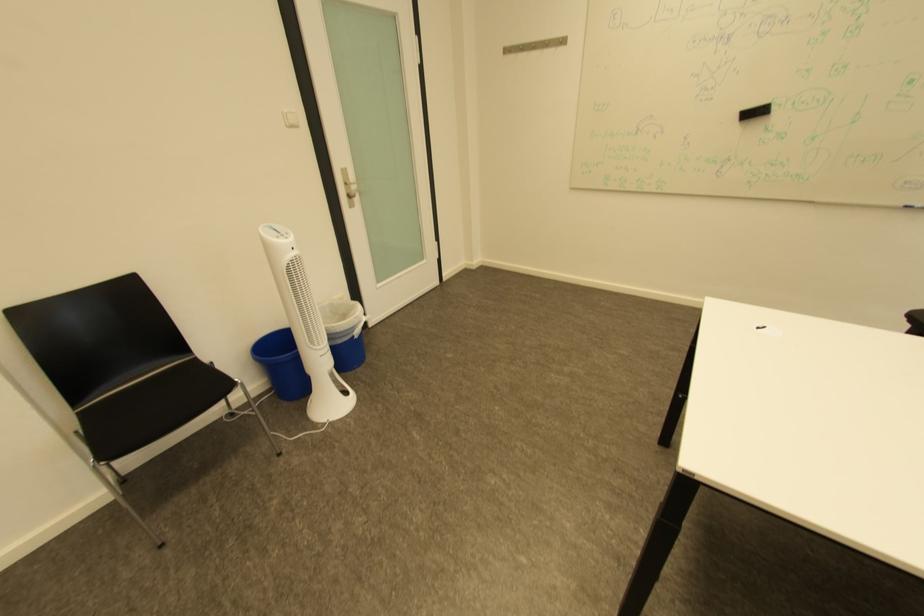
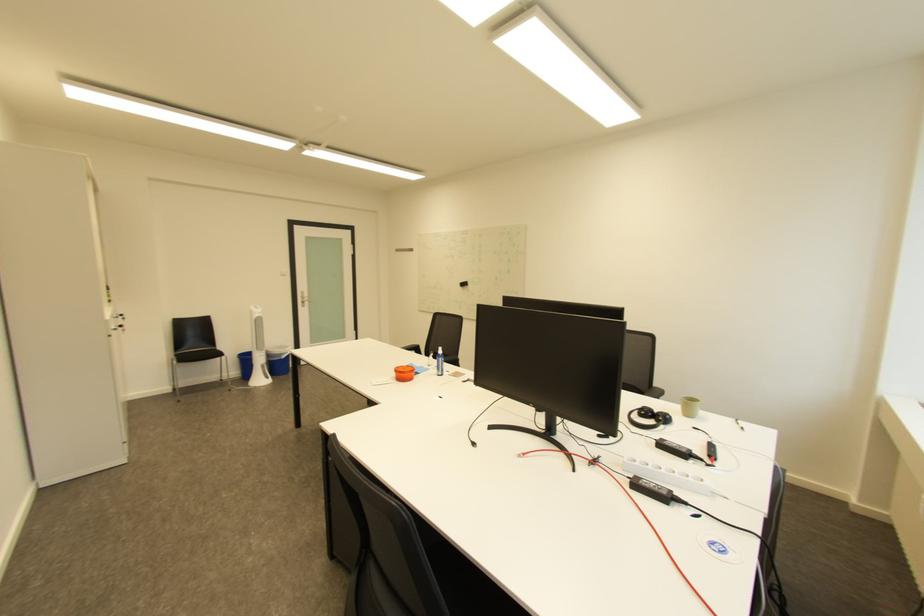
The point at (341, 376) is marked in the first image. Where is the corresponding point in the second image?

(273, 367)